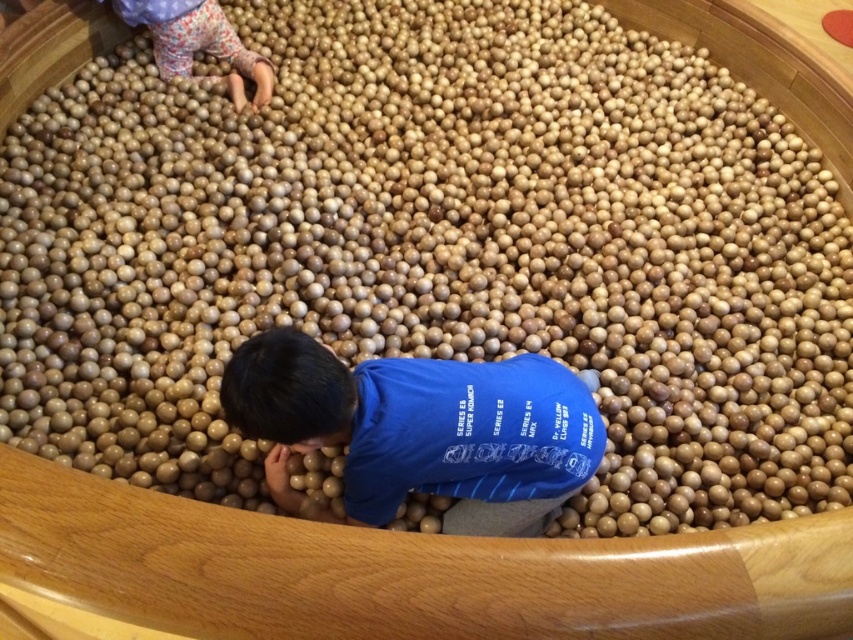
Who is lower down, blue matte shirt at center or floral fabric pants at upper left?

Positioned lower is blue matte shirt at center.

Does point (466, 372) come farther from viewer compared to point (212, 1)?

That is False.

Image resolution: width=853 pixels, height=640 pixels. Identify the location of blue matte shirt at center. (419, 429).

The height and width of the screenshot is (640, 853). I want to click on blue matte shirt at center, so click(x=419, y=429).